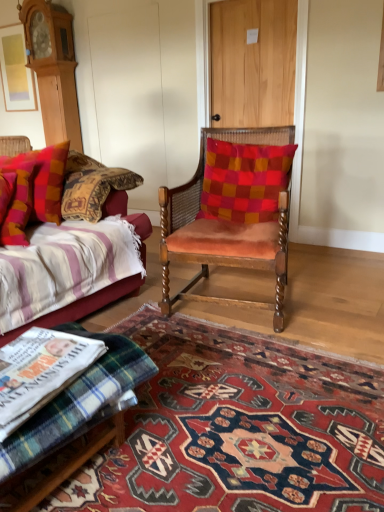
The width and height of the screenshot is (384, 512). Find the location of `free location above carpet with intricate patterns at center (from a real-world perspective)`. free location above carpet with intricate patterns at center (from a real-world perspective) is located at coordinates (233, 413).